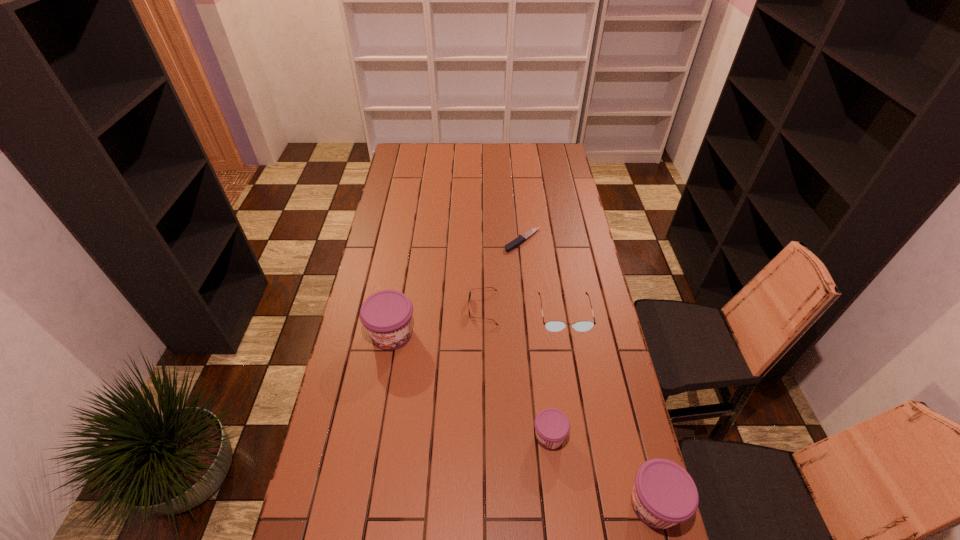
You are a GUI agent. You are given a task and a screenshot of the screen. Output one action in this format:
    pyautogui.click(x=<x>, y=<y>)
    Task: Click on the free region located on the lenses of the sunglasses
    
    Given the screenshot: What is the action you would take?
    pyautogui.click(x=436, y=308)

This screenshot has height=540, width=960. I want to click on free space located on the lenses of the sunglasses, so click(x=359, y=308).

Where is `free spot located 0.370m on the lenses of the sunglasses`? free spot located 0.370m on the lenses of the sunglasses is located at coordinates (368, 308).

In order to click on object that is at the near edge in this screenshot , I will do `click(664, 494)`.

I want to click on object situated at the left edge, so click(x=387, y=315).

This screenshot has width=960, height=540. What are the coordinates of `jam that is at the right edge` in the screenshot? It's located at (664, 494).

Image resolution: width=960 pixels, height=540 pixels. Identify the location of spectacles that is positioned at the right edge. (554, 326).

This screenshot has height=540, width=960. Find the location of `object that is positioned at the near right corner`. object that is positioned at the near right corner is located at coordinates (664, 494).

I want to click on free space at the far edge of the desktop, so click(x=524, y=152).

This screenshot has height=540, width=960. I want to click on vacant space at the near edge, so click(574, 518).